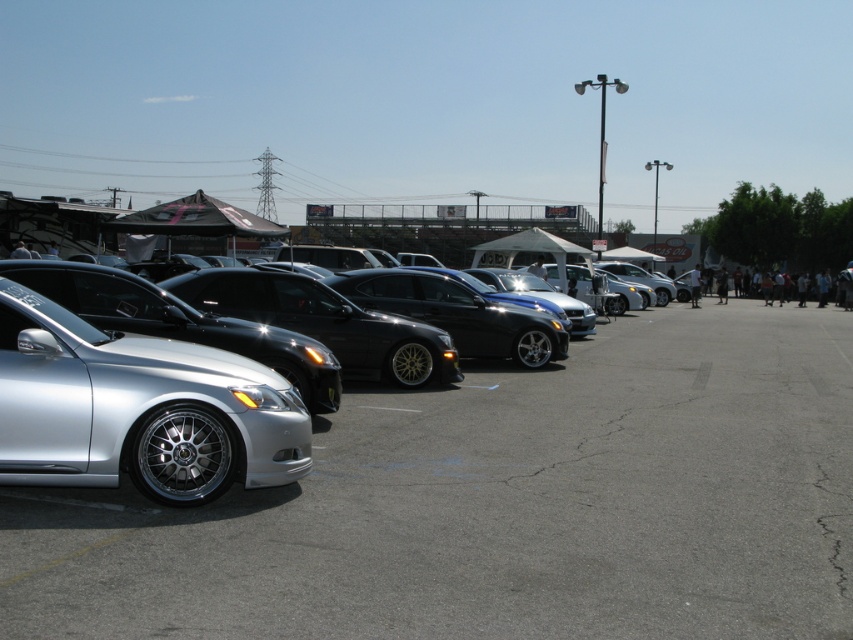
Does silver metallic car at left have a greater height compared to silver metallic sedan at left?

Incorrect, silver metallic car at left's height is not larger of silver metallic sedan at left's.

Does point (740, 374) come farther from viewer compared to point (273, 340)?

Yes, it is.

Is point (621, 477) behind point (448, 346)?

No.

Image resolution: width=853 pixels, height=640 pixels. What are the coordinates of `silver metallic car at left` in the screenshot? It's located at (502, 506).

Can you confirm if silver polished alloy wheel at left is wider than silver metallic sedan at left?

No.

Which is below, silver polished alloy wheel at left or silver metallic sedan at left?

Positioned lower is silver polished alloy wheel at left.

Find the location of a particular element. Image resolution: width=853 pixels, height=640 pixels. silver polished alloy wheel at left is located at coordinates pos(137,408).

Image resolution: width=853 pixels, height=640 pixels. I want to click on silver polished alloy wheel at left, so click(x=137, y=408).

Can you confirm if silver metallic car at left is positioned to the left of silver polished alloy wheel at left?

No, silver metallic car at left is not to the left of silver polished alloy wheel at left.

Does silver metallic car at left lie behind silver polished alloy wheel at left?

No, it is not.

Which is in front, point (602, 481) or point (172, 504)?

Point (172, 504)

The image size is (853, 640). What are the coordinates of `silver metallic car at left` in the screenshot? It's located at (502, 506).